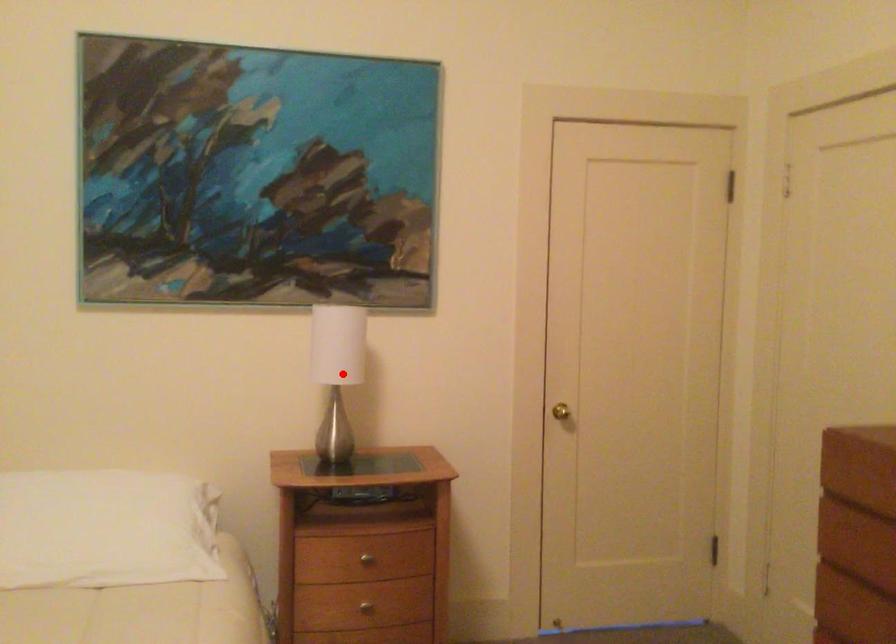
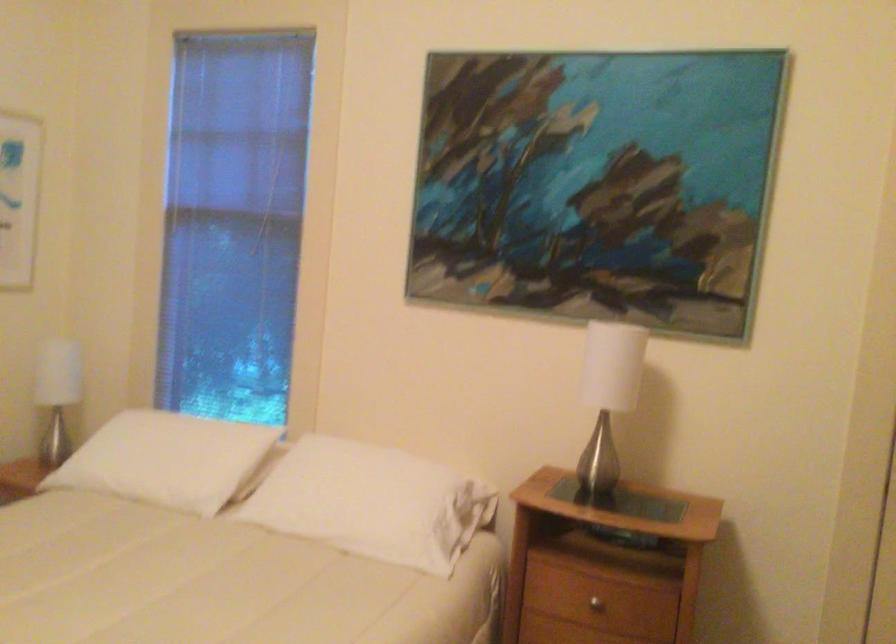
Where in the second image is the point corresponding to the highlighted location from the first image?

(607, 397)